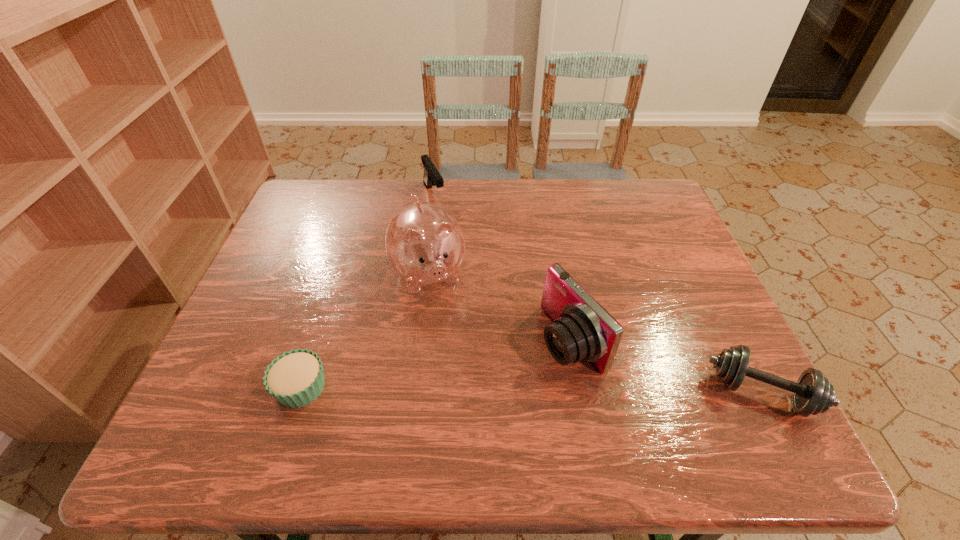
You are a GUI agent. You are given a task and a screenshot of the screen. Output one action in this format:
    pyautogui.click(x=<x>, y=<y>)
    Task: Click on the free spot between the camera and the piggy bank
    This screenshot has height=540, width=960.
    Given the screenshot: What is the action you would take?
    pyautogui.click(x=500, y=307)

Choose which object is the third nearest neighbor to the piggy bank. Please provide its 2D coordinates. Your answer should be formatted as a tuple, i.e. [(x, y)], where the tuple contains the x and y coordinates of a point satisfying the conditions above.

[(296, 378)]

Locate an element on the screen. This screenshot has width=960, height=540. the second closest object to the piggy bank is located at coordinates (582, 330).

Locate an element on the screen. The image size is (960, 540). blank space that satisfies the following two spatial constraints: 1. on the front side of the rightmost object; 2. on the left side of the cupcake is located at coordinates (300, 392).

I want to click on free region that satisfies the following two spatial constraints: 1. on the front side of the pistol; 2. on the left side of the rightmost object, so click(409, 392).